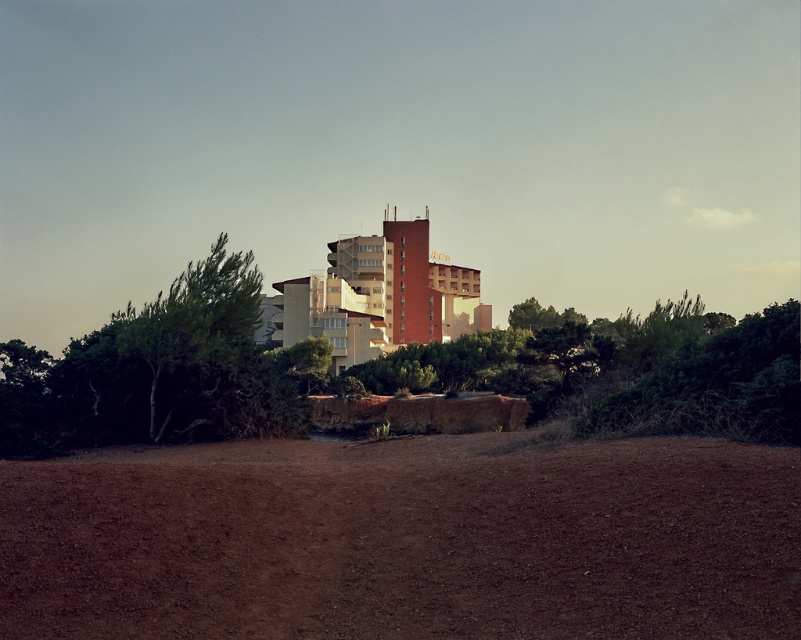
Question: Does brown soil at lower center appear on the right side of green leafy tree at left?

Choices:
 (A) yes
 (B) no

Answer: (A)

Question: Which of the following is the farthest from the observer?

Choices:
 (A) (200, 573)
 (B) (176, 394)

Answer: (B)

Question: Does brown soil at lower center have a greater width compared to green leafy tree at left?

Choices:
 (A) no
 (B) yes

Answer: (A)

Question: Is brown soil at lower center thinner than green leafy tree at left?

Choices:
 (A) yes
 (B) no

Answer: (A)

Question: Among these points, which one is farthest from the camera?

Choices:
 (A) (775, 456)
 (B) (139, 413)

Answer: (B)